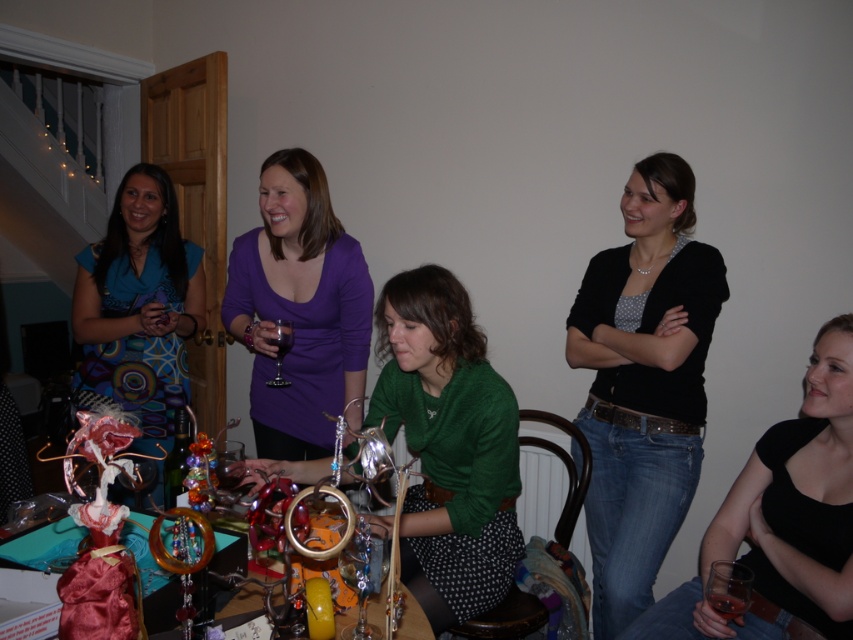
Question: Considering the real-world distances, which object is farthest from the green matte sweater at center?

Choices:
 (A) transparent glass wine glass at lower right
 (B) transparent glass at center

Answer: (A)

Question: Among these objects, which one is nearest to the camera?

Choices:
 (A) black matte dress at lower right
 (B) purple matte shirt at center
 (C) matte blue dress at left
 (D) transparent glass wine glass at center

Answer: (D)

Question: Does green matte sweater at center have a lesser width compared to translucent glass wine at lower right?

Choices:
 (A) no
 (B) yes

Answer: (A)

Question: Is the position of translucent glass wine at lower right more distant than that of transparent glass at center?

Choices:
 (A) no
 (B) yes

Answer: (A)

Question: Can you confirm if shiny metallic jewelry stand at center is bigger than transparent glass wine glass at lower right?

Choices:
 (A) yes
 (B) no

Answer: (A)

Question: Which object is positioned closest to the black matte dress at lower right?

Choices:
 (A) shiny metallic jewelry stand at center
 (B) matte blue dress at left
 (C) translucent glass wine at center
 (D) translucent glass wine at lower right

Answer: (D)